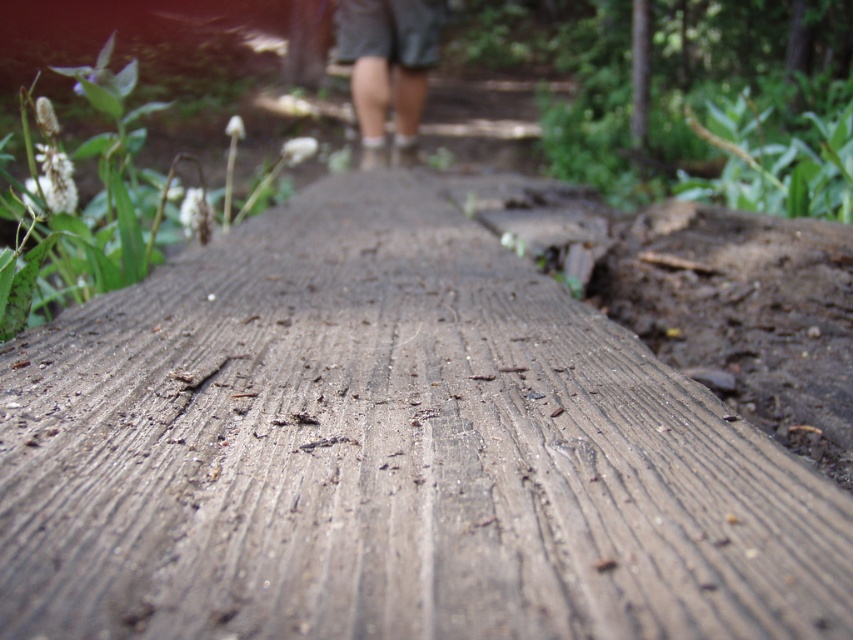
You are standing at the point marked as point (x=138, y=508) on a wooden path. You want to place a small pebble exactly 24 inches away from your current position. Is this possible without moving past the visible wooden surface?

The distance between point (x=138, y=508) and the viewer is 26.47 inches. Since you want to place the pebble 24 inches away, which is within the available distance, yes, it is possible to place the pebble without moving past the visible wooden surface.

You are navigating a hiking trail and need to step onto the weathered wood at center. Based on its position, can you determine if it is positioned to the left or right side of the trail?

The weathered wood at center is located at point coordinates that are not directional indicators, so its exact left or right position relative to the trail cannot be determined from the given information.

You are designing a new outdoor pathway and need to ensure the planks can accommodate hikers with typical boot widths. You observe the weathered wood at center and the dark green shorts at center in the image. Which object has a smaller width?

The weathered wood at center has a smaller width than the dark green shorts at center according to the description.